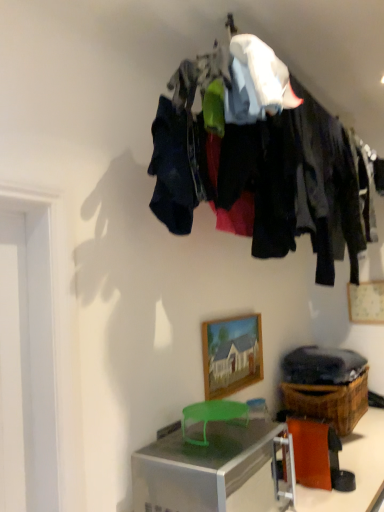
Image resolution: width=384 pixels, height=512 pixels. Describe the element at coordinates (208, 471) in the screenshot. I see `silver metallic desk at lower center` at that location.

The width and height of the screenshot is (384, 512). Describe the element at coordinates (354, 470) in the screenshot. I see `orange paper at lower right` at that location.

Identify the location of brown woven basket at lower right. (329, 402).

Consider the image. What is the approximate height of dark fabric clothes at upper center?

The height of dark fabric clothes at upper center is 32.09 inches.

Image resolution: width=384 pixels, height=512 pixels. I want to click on wooden picture frame at center, the 2th picture frame when ordered from back to front, so click(231, 355).

How different are the orientations of wooden picture frame at center, marked as the second picture frame in a right-to-left arrangement, and silver metallic desk at lower center in degrees?

0.329 degrees separate the facing orientations of wooden picture frame at center, marked as the second picture frame in a right-to-left arrangement, and silver metallic desk at lower center.

Considering the relative positions of wooden picture frame at center, which is the first picture frame from front to back, and silver metallic desk at lower center in the image provided, is wooden picture frame at center, which is the first picture frame from front to back, to the left or to the right of silver metallic desk at lower center?

Based on their positions, wooden picture frame at center, which is the first picture frame from front to back, is located to the left of silver metallic desk at lower center.

Can you confirm if wooden picture frame at center, the 2th picture frame when ordered from back to front, is shorter than silver metallic desk at lower center?

Yes.

Is point (212, 375) closer or farther from the camera than point (174, 511)?

Point (212, 375).

From the image's perspective, is brown woven basket at lower right on top of silver metallic desk at lower center?

Yes.

Could you tell me if brown woven basket at lower right is facing silver metallic desk at lower center?

No, brown woven basket at lower right is not facing towards silver metallic desk at lower center.

From their relative heights in the image, would you say brown woven basket at lower right is taller or shorter than silver metallic desk at lower center?

In the image, brown woven basket at lower right appears to be shorter than silver metallic desk at lower center.

Is there a large distance between brown woven basket at lower right and silver metallic desk at lower center?

brown woven basket at lower right is near silver metallic desk at lower center, not far away.

Who is shorter, dark fabric clothes at upper center or wooden picture frame at center, marked as the second picture frame in a right-to-left arrangement?

Standing shorter between the two is wooden picture frame at center, marked as the second picture frame in a right-to-left arrangement.

From the image's perspective, relative to wooden picture frame at center, the 2th picture frame when ordered from back to front, is dark fabric clothes at upper center above or below?

dark fabric clothes at upper center is situated higher than wooden picture frame at center, the 2th picture frame when ordered from back to front, in the image.

In the image, there is a wooden picture frame at center, placed as the 1th picture frame when sorted from left to right. Identify the location of closet above it (from the image's perspective). The image size is (384, 512). (263, 160).

From the image's perspective, which one is positioned lower, brown woven basket at lower right or wooden picture frame at center, the 2th picture frame when ordered from back to front?

brown woven basket at lower right, from the image's perspective.

Are brown woven basket at lower right and wooden picture frame at center, the 2th picture frame when ordered from back to front, beside each other?

brown woven basket at lower right and wooden picture frame at center, the 2th picture frame when ordered from back to front, are not in contact.

Where is `the 1st picture frame positioned above the brown woven basket at lower right (from a real-world perspective)`? This screenshot has width=384, height=512. the 1st picture frame positioned above the brown woven basket at lower right (from a real-world perspective) is located at coordinates (231, 355).

Can you confirm if brown woven basket at lower right is bigger than wooden picture frame at center, marked as the second picture frame in a right-to-left arrangement?

Correct, brown woven basket at lower right is larger in size than wooden picture frame at center, marked as the second picture frame in a right-to-left arrangement.

In the scene shown: Is silver metallic desk at lower center further to camera compared to dark fabric clothes at upper center?

No, silver metallic desk at lower center is in front of dark fabric clothes at upper center.

The image size is (384, 512). Find the location of `desk below the dark fabric clothes at upper center (from the image's perspective)`. desk below the dark fabric clothes at upper center (from the image's perspective) is located at coordinates (208, 471).

Which of these two, silver metallic desk at lower center or dark fabric clothes at upper center, stands shorter?

Standing shorter between the two is dark fabric clothes at upper center.

Considering the relative sizes of orange paper at lower right and brown woven basket at lower right in the image provided, is orange paper at lower right shorter than brown woven basket at lower right?

Correct, orange paper at lower right is not as tall as brown woven basket at lower right.

Is orange paper at lower right looking in the opposite direction of brown woven basket at lower right?

No, orange paper at lower right is not facing the opposite direction of brown woven basket at lower right.

Is orange paper at lower right to the left of brown woven basket at lower right from the viewer's perspective?

Yes.

Which object is closer to the camera, orange paper at lower right or wooden picture frame at center, which is the first picture frame from front to back?

orange paper at lower right is in front.

Which object is positioned more to the right, orange paper at lower right or wooden picture frame at center, marked as the second picture frame in a right-to-left arrangement?

orange paper at lower right.

Is orange paper at lower right wider than wooden picture frame at center, placed as the 1th picture frame when sorted from left to right?

Correct, the width of orange paper at lower right exceeds that of wooden picture frame at center, placed as the 1th picture frame when sorted from left to right.

Considering the relative sizes of orange paper at lower right and wooden picture frame at center, which is the first picture frame from front to back, in the image provided, is orange paper at lower right smaller than wooden picture frame at center, which is the first picture frame from front to back,?

No, orange paper at lower right is not smaller than wooden picture frame at center, which is the first picture frame from front to back.

This screenshot has height=512, width=384. I want to click on desk below the wooden picture frame at center, marked as the second picture frame in a right-to-left arrangement (from a real-world perspective), so click(x=208, y=471).

This screenshot has height=512, width=384. What are the coordinates of `crate behind the silver metallic desk at lower center` in the screenshot? It's located at [x=329, y=402].

Which object lies nearer to the anchor point brown woven basket at lower right, dark fabric clothes at upper center or wooden picture frame at upper right, which appears as the 2th picture frame when viewed from the left?

wooden picture frame at upper right, which appears as the 2th picture frame when viewed from the left, lies closer to brown woven basket at lower right than the other object.

Considering their positions, is orange paper at lower right positioned closer to dark fabric clothes at upper center than brown woven basket at lower right?

brown woven basket at lower right is closer to dark fabric clothes at upper center.

Considering their positions, is wooden picture frame at upper right, which is counted as the first picture frame, starting from the back, positioned closer to dark fabric clothes at upper center than brown woven basket at lower right?

Based on the image, brown woven basket at lower right appears to be nearer to dark fabric clothes at upper center.

From the picture: Estimate the real-world distances between objects in this image. Which object is further from dark fabric clothes at upper center, brown woven basket at lower right or orange paper at lower right?

orange paper at lower right lies further to dark fabric clothes at upper center than the other object.

Based on their spatial positions, is dark fabric clothes at upper center or silver metallic desk at lower center closer to wooden picture frame at upper right, which appears as the 2th picture frame when viewed from the left?

silver metallic desk at lower center lies closer to wooden picture frame at upper right, which appears as the 2th picture frame when viewed from the left, than the other object.

Estimate the real-world distances between objects in this image. Which object is further from orange paper at lower right, dark fabric clothes at upper center or silver metallic desk at lower center?

dark fabric clothes at upper center lies further to orange paper at lower right than the other object.

When comparing their distances from wooden picture frame at upper right, the second picture frame viewed from the front, does brown woven basket at lower right or orange paper at lower right seem further?

Based on the image, orange paper at lower right appears to be further to wooden picture frame at upper right, the second picture frame viewed from the front.

Which object lies nearer to the anchor point wooden picture frame at upper right, marked as the first picture frame in a right-to-left arrangement, brown woven basket at lower right or dark fabric clothes at upper center?

brown woven basket at lower right lies closer to wooden picture frame at upper right, marked as the first picture frame in a right-to-left arrangement, than the other object.

At what (x,y) coordinates should I click in order to perform the action: click on table between dark fabric clothes at upper center and silver metallic desk at lower center vertically. Please return your answer as a coordinate pair (x, y). The width and height of the screenshot is (384, 512). Looking at the image, I should click on (354, 470).

At what (x,y) coordinates should I click in order to perform the action: click on crate between silver metallic desk at lower center and wooden picture frame at upper right, marked as the first picture frame in a right-to-left arrangement, along the z-axis. Please return your answer as a coordinate pair (x, y). This screenshot has width=384, height=512. Looking at the image, I should click on (329, 402).

Where is `crate between orange paper at lower right and wooden picture frame at upper right, marked as the first picture frame in a right-to-left arrangement, in the front-back direction`? crate between orange paper at lower right and wooden picture frame at upper right, marked as the first picture frame in a right-to-left arrangement, in the front-back direction is located at coordinates (329, 402).

Find the location of a particular element. This screenshot has width=384, height=512. crate between dark fabric clothes at upper center and wooden picture frame at upper right, marked as the first picture frame in a right-to-left arrangement, in the front-back direction is located at coordinates (329, 402).